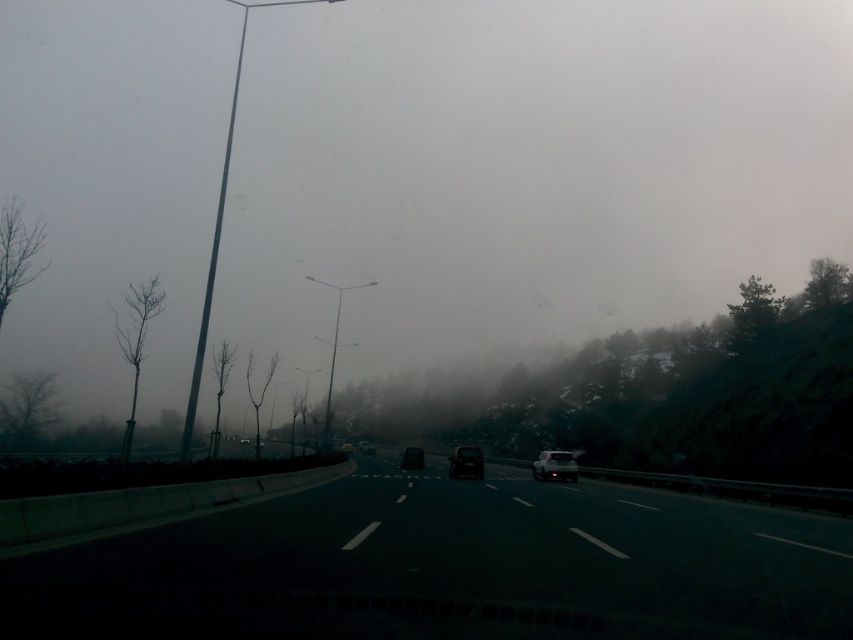
Question: Can you confirm if black asphalt highway at center is positioned to the right of shiny black sedan at center?

Choices:
 (A) yes
 (B) no

Answer: (A)

Question: Can you confirm if black matte car at center is wider than black glossy car at center?

Choices:
 (A) yes
 (B) no

Answer: (B)

Question: Estimate the real-world distances between objects in this image. Which object is farther from the black asphalt highway at center?

Choices:
 (A) shiny black sedan at center
 (B) black matte car at center
 (C) satin white sedan at center

Answer: (A)

Question: Estimate the real-world distances between objects in this image. Which object is closer to the satin white sedan at center?

Choices:
 (A) black asphalt highway at center
 (B) black glossy car at center

Answer: (B)

Question: Which of these objects is positioned closest to the black asphalt highway at center?

Choices:
 (A) black matte car at center
 (B) shiny black sedan at center
 (C) black glossy car at center
 (D) satin white sedan at center

Answer: (A)

Question: Can you confirm if black asphalt highway at center is thinner than black matte car at center?

Choices:
 (A) yes
 (B) no

Answer: (B)